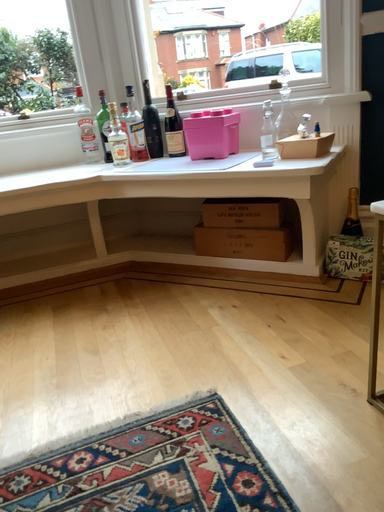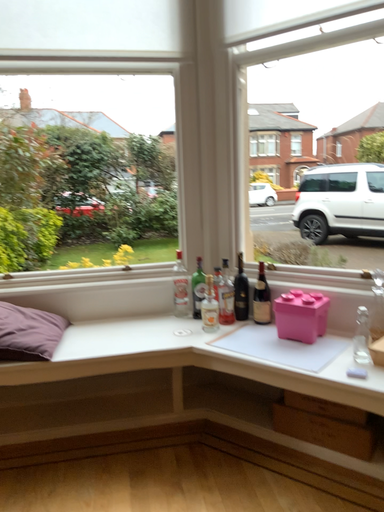
Question: Which way did the camera rotate in the video?

Choices:
 (A) rotated right
 (B) rotated left

Answer: (B)